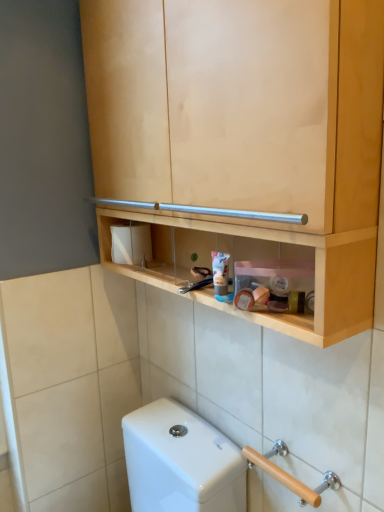
Question: Is the depth of white glossy toothpaste at center greater than that of white matte toilet paper at center?

Choices:
 (A) no
 (B) yes

Answer: (A)

Question: Can you confirm if white glossy toothpaste at center is positioned to the left of white matte toilet paper at center?

Choices:
 (A) no
 (B) yes

Answer: (A)

Question: Are white glossy toothpaste at center and white matte toilet paper at center far apart?

Choices:
 (A) no
 (B) yes

Answer: (A)

Question: Is white matte toilet paper at center completely or partially inside white glossy toothpaste at center?

Choices:
 (A) yes
 (B) no

Answer: (B)

Question: Does white glossy toothpaste at center have a smaller size compared to white matte toilet paper at center?

Choices:
 (A) yes
 (B) no

Answer: (A)

Question: Would you say white glossy toothpaste at center is outside white matte toilet paper at center?

Choices:
 (A) yes
 (B) no

Answer: (A)

Question: From the image's perspective, does white glossy toothpaste at center appear higher than natural wood cabinet at upper center?

Choices:
 (A) yes
 (B) no

Answer: (B)

Question: Can you confirm if white glossy toothpaste at center is wider than natural wood cabinet at upper center?

Choices:
 (A) yes
 (B) no

Answer: (B)

Question: Is white glossy toothpaste at center not close to natural wood cabinet at upper center?

Choices:
 (A) no
 (B) yes

Answer: (A)

Question: Is white glossy toothpaste at center positioned with its back to natural wood cabinet at upper center?

Choices:
 (A) yes
 (B) no

Answer: (A)

Question: Considering the relative sizes of white glossy toothpaste at center and natural wood cabinet at upper center in the image provided, is white glossy toothpaste at center thinner than natural wood cabinet at upper center?

Choices:
 (A) no
 (B) yes

Answer: (B)

Question: Is white glossy toothpaste at center at the right side of natural wood cabinet at upper center?

Choices:
 (A) no
 (B) yes

Answer: (B)

Question: Does wooden at lower right have a lesser height compared to natural wood cabinet at upper center?

Choices:
 (A) no
 (B) yes

Answer: (B)